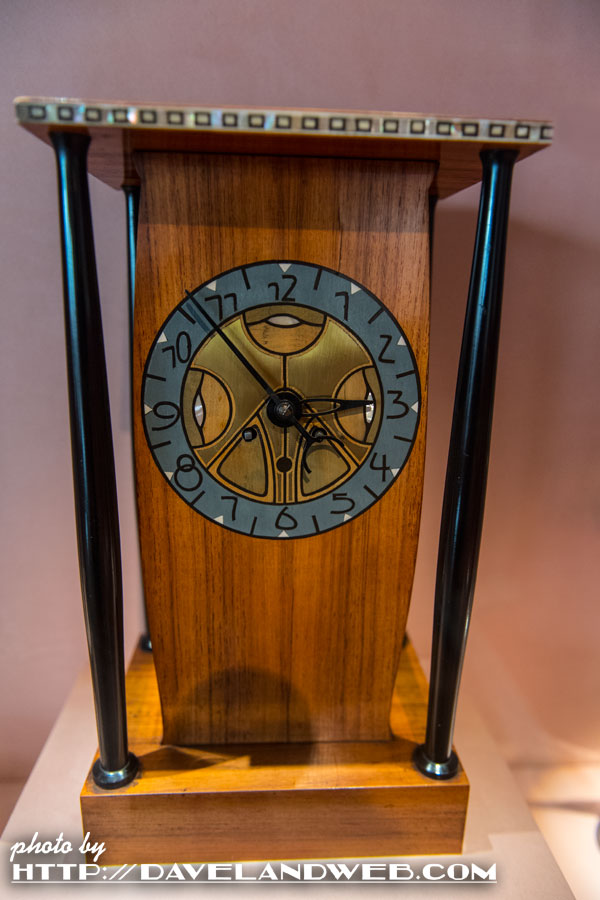
Image resolution: width=600 pixels, height=900 pixels. I want to click on decorative border, so click(x=177, y=117).